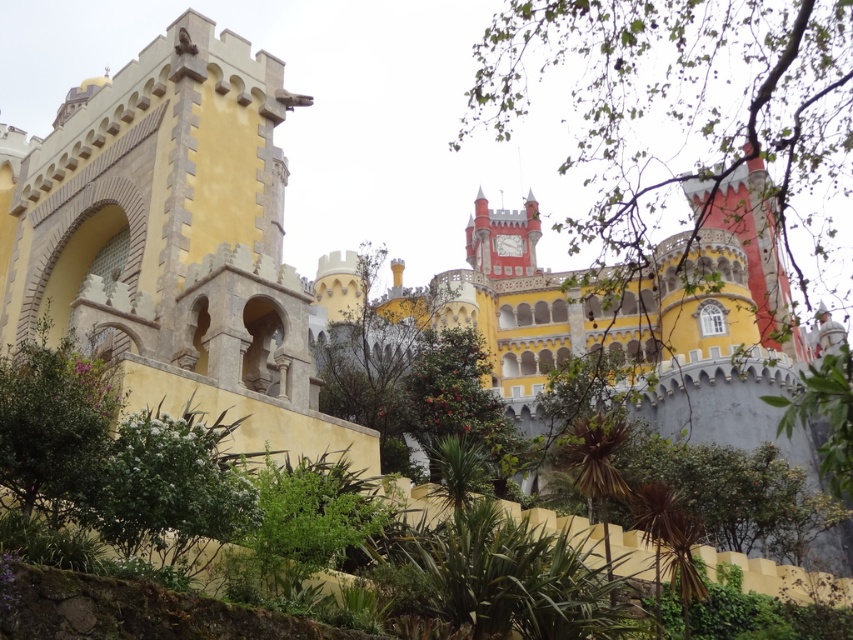
Is point (253, 504) closer to viewer compared to point (82, 410)?

No, (253, 504) is further to viewer.

The height and width of the screenshot is (640, 853). In order to click on green leafy bush at lower center in this screenshot , I will do `click(169, 490)`.